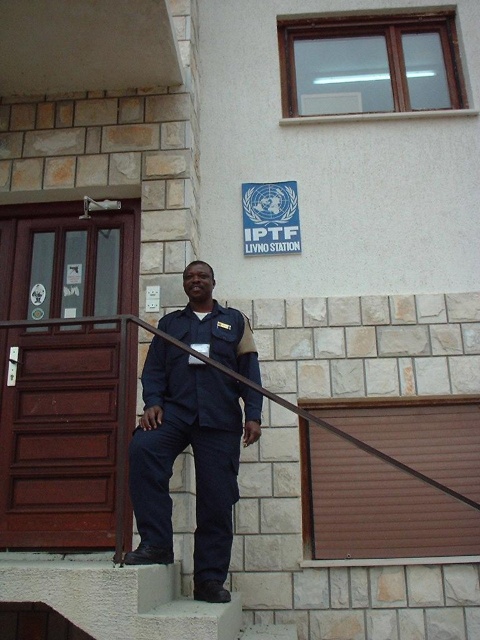
Question: Does dark blue uniform at center have a lesser width compared to concrete at center?

Choices:
 (A) no
 (B) yes

Answer: (B)

Question: Among these points, which one is farthest from the camera?

Choices:
 (A) (203, 634)
 (B) (217, 408)

Answer: (B)

Question: Can you confirm if dark blue uniform at center is positioned below concrete at center?

Choices:
 (A) no
 (B) yes

Answer: (A)

Question: Is dark blue uniform at center closer to camera compared to concrete at center?

Choices:
 (A) no
 (B) yes

Answer: (A)